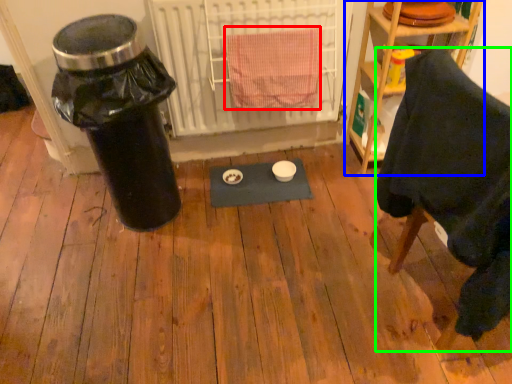
Question: Which object is the farthest from bath towel (highlighted by a red box)? Choose among these: shelf (highlighted by a blue box) or furniture (highlighted by a green box).

Choices:
 (A) shelf
 (B) furniture

Answer: (B)